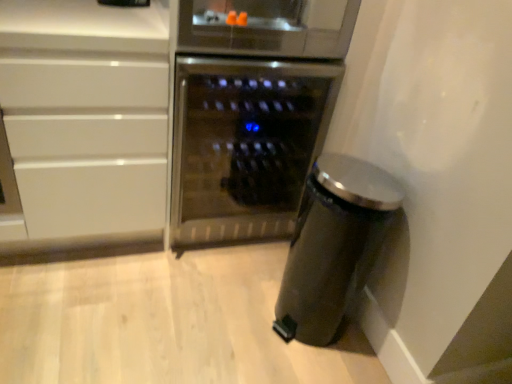
Question: Is satin black trash can at lower right outside white glossy cabinet at left?

Choices:
 (A) yes
 (B) no

Answer: (A)

Question: From a real-world perspective, is satin black trash can at lower right positioned under white glossy cabinet at left based on gravity?

Choices:
 (A) no
 (B) yes

Answer: (B)

Question: Can you confirm if satin black trash can at lower right is thinner than white glossy cabinet at left?

Choices:
 (A) yes
 (B) no

Answer: (A)

Question: Is satin black trash can at lower right to the left of white glossy cabinet at left from the viewer's perspective?

Choices:
 (A) no
 (B) yes

Answer: (A)

Question: Considering the relative sizes of satin black trash can at lower right and white glossy cabinet at left in the image provided, is satin black trash can at lower right smaller than white glossy cabinet at left?

Choices:
 (A) no
 (B) yes

Answer: (B)

Question: Is satin black trash can at lower right wider than white glossy cabinet at left?

Choices:
 (A) yes
 (B) no

Answer: (B)

Question: Does satin black trash can at lower right contain stainless steel wine cooler at center?

Choices:
 (A) yes
 (B) no

Answer: (B)

Question: Considering the relative positions of satin black trash can at lower right and stainless steel wine cooler at center in the image provided, is satin black trash can at lower right to the right of stainless steel wine cooler at center from the viewer's perspective?

Choices:
 (A) yes
 (B) no

Answer: (A)

Question: Is satin black trash can at lower right located outside stainless steel wine cooler at center?

Choices:
 (A) yes
 (B) no

Answer: (A)

Question: Is satin black trash can at lower right further to camera compared to stainless steel wine cooler at center?

Choices:
 (A) yes
 (B) no

Answer: (B)

Question: Can you confirm if satin black trash can at lower right is bigger than stainless steel wine cooler at center?

Choices:
 (A) no
 (B) yes

Answer: (A)

Question: Is satin black trash can at lower right far away from stainless steel wine cooler at center?

Choices:
 (A) no
 (B) yes

Answer: (A)

Question: Can you confirm if white glossy cabinet at left is taller than stainless steel wine cooler at center?

Choices:
 (A) no
 (B) yes

Answer: (B)